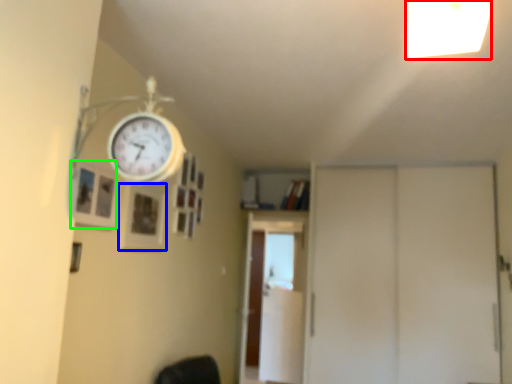
Question: Which object is positioned closest to light fixture (highlighted by a red box)? Select from picture frame (highlighted by a blue box) and picture frame (highlighted by a green box).

Choices:
 (A) picture frame
 (B) picture frame

Answer: (B)